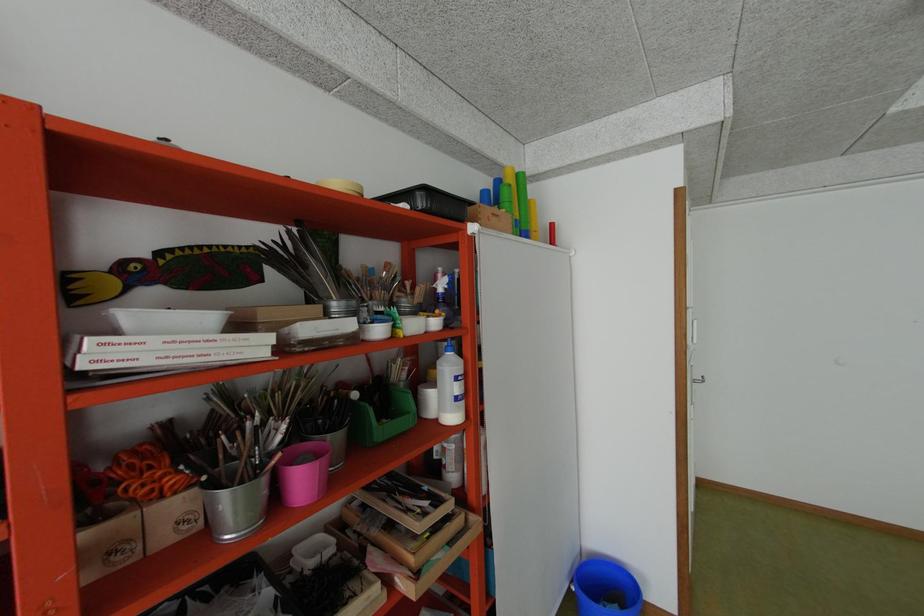
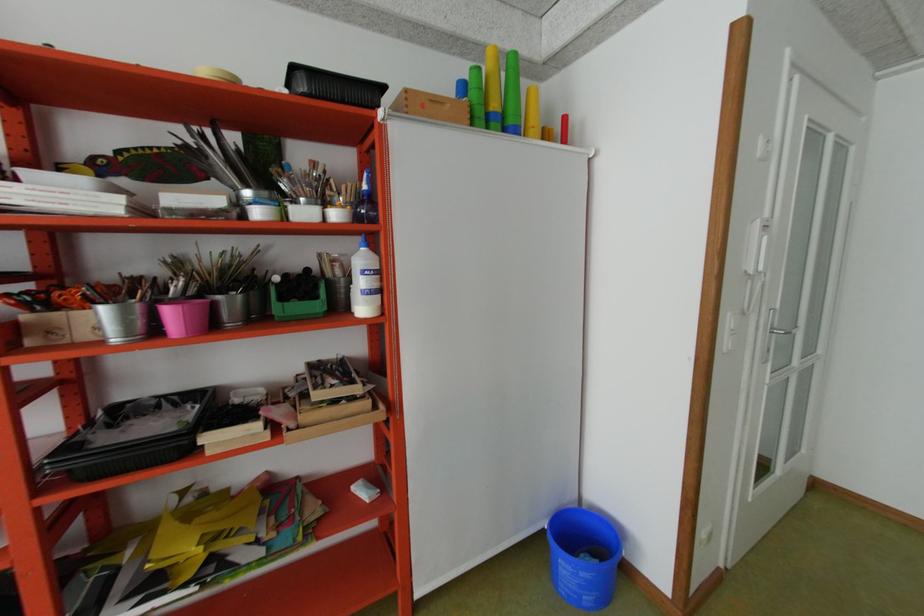
In the second image, find the point that corresponds to (467,379) in the first image.

(372, 273)